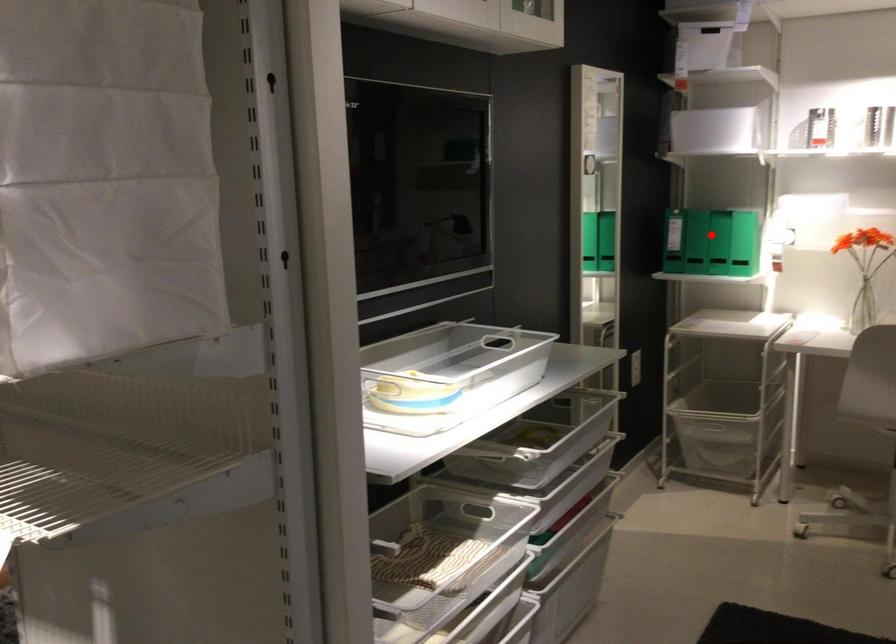
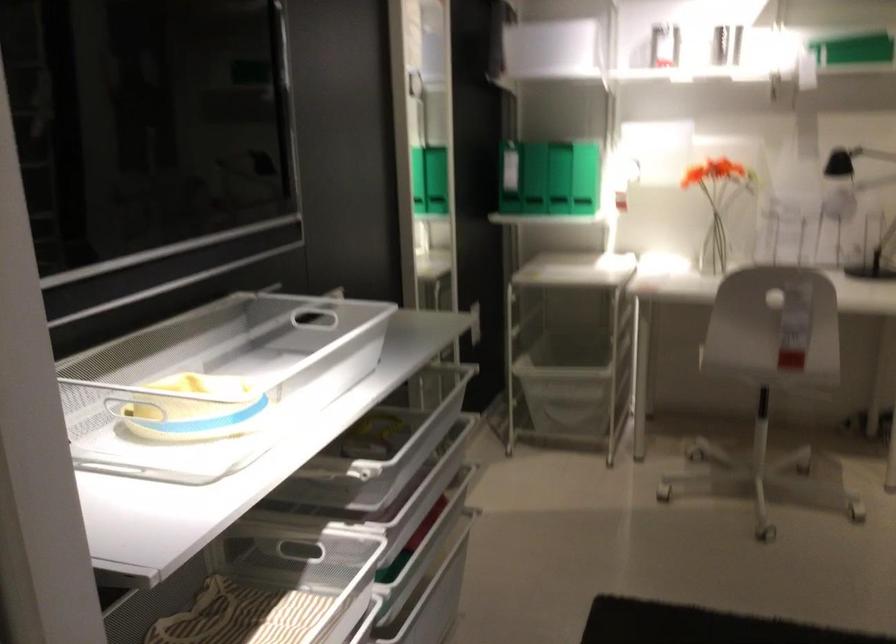
Locate, in the second image, the point that corresponds to the highlighted location in the first image.

(533, 178)